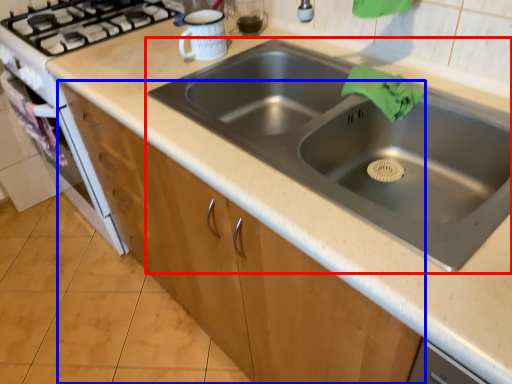
Question: Among these objects, which one is nearest to the camera, sink (highlighted by a red box) or cabinetry (highlighted by a blue box)?

Choices:
 (A) sink
 (B) cabinetry

Answer: (A)